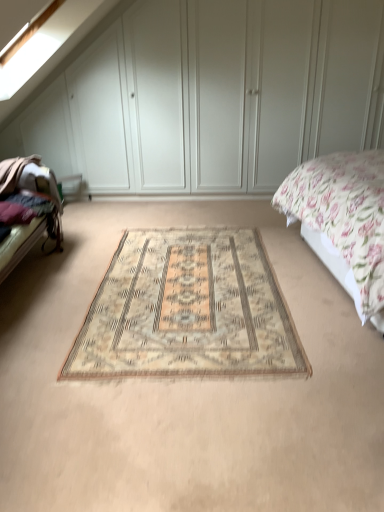
Find the location of a particular element. The height and width of the screenshot is (512, 384). free point below beige woven rug at center (from a real-world perspective) is located at coordinates (213, 292).